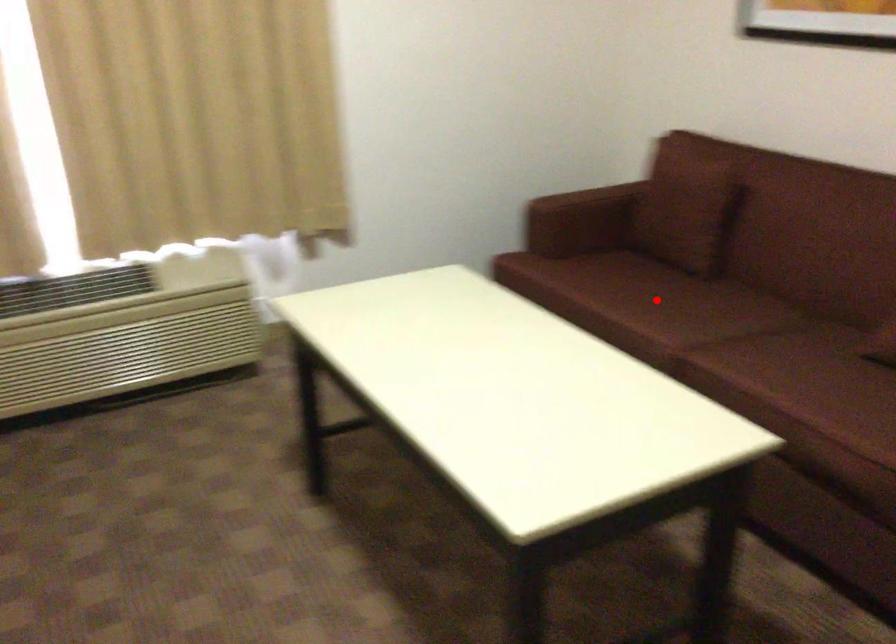
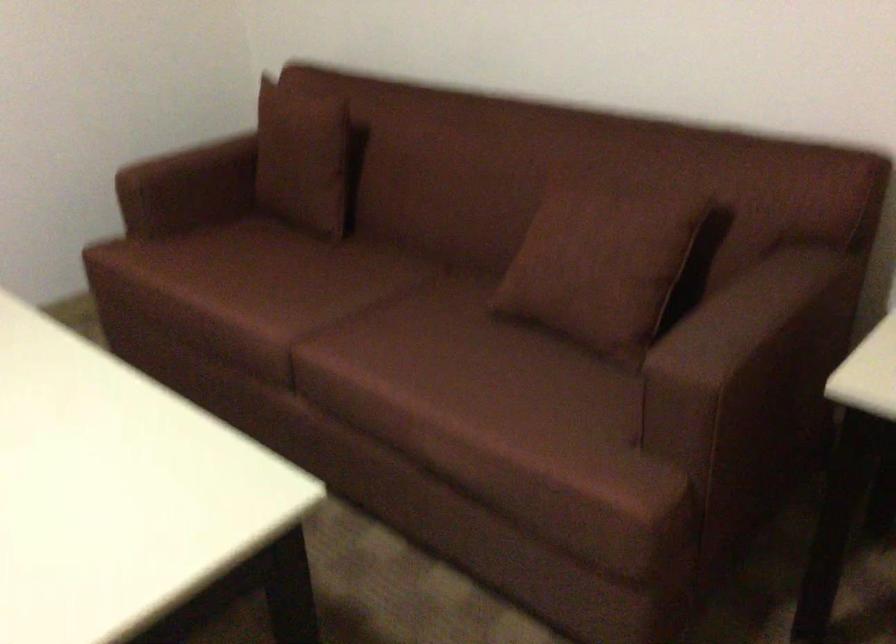
Locate, in the second image, the point that corresponds to the highlighted location in the first image.

(286, 283)